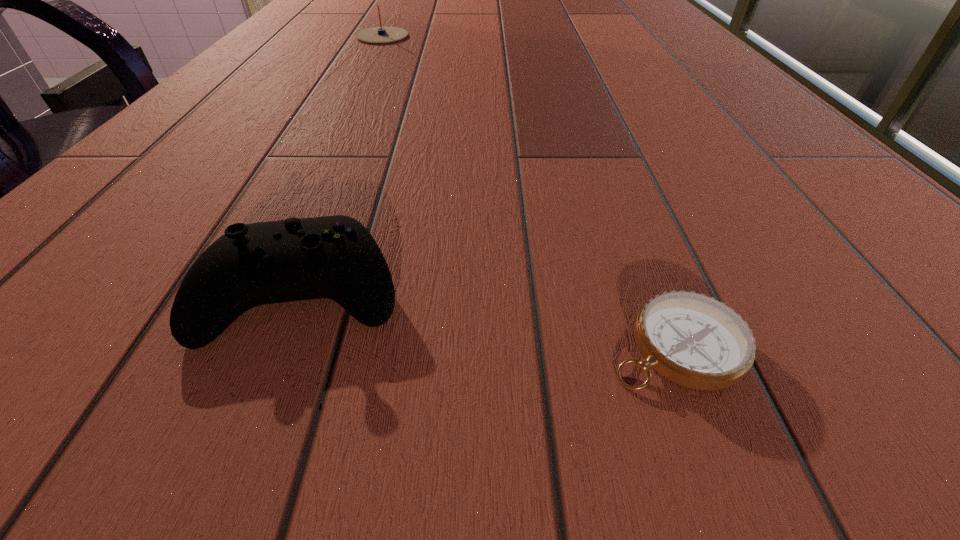
The width and height of the screenshot is (960, 540). In the image, there is a desktop. What are the coordinates of `vacant area at the left edge` in the screenshot? It's located at (309, 6).

Locate an element on the screen. The height and width of the screenshot is (540, 960). free space at the right edge of the desktop is located at coordinates (740, 166).

Find the location of a particular element. unoccupied position between the control and the right compass is located at coordinates (490, 318).

Identify the location of blank region between the shorter compass and the control. The width and height of the screenshot is (960, 540). (490, 318).

Where is `vacant area that lies between the control and the left compass`? Image resolution: width=960 pixels, height=540 pixels. vacant area that lies between the control and the left compass is located at coordinates (344, 164).

You are a GUI agent. You are given a task and a screenshot of the screen. Output one action in this format:
    pyautogui.click(x=<x>, y=<y>)
    Task: Click on the free space between the right compass and the taller compass
    
    Given the screenshot: What is the action you would take?
    pyautogui.click(x=529, y=191)

This screenshot has height=540, width=960. In order to click on free space that is in between the right compass and the farthest object in this screenshot , I will do `click(529, 191)`.

At what (x,y) coordinates should I click in order to perform the action: click on vacant space that's between the control and the shorter compass. Please return your answer as a coordinate pair (x, y). This screenshot has width=960, height=540. Looking at the image, I should click on (490, 318).

Locate an element on the screen. The width and height of the screenshot is (960, 540). object that is the second closest to the left compass is located at coordinates (691, 339).

Select which object appears as the closest to the control. Please provide its 2D coordinates. Your answer should be formatted as a tuple, i.e. [(x, y)], where the tuple contains the x and y coordinates of a point satisfying the conditions above.

[(691, 339)]